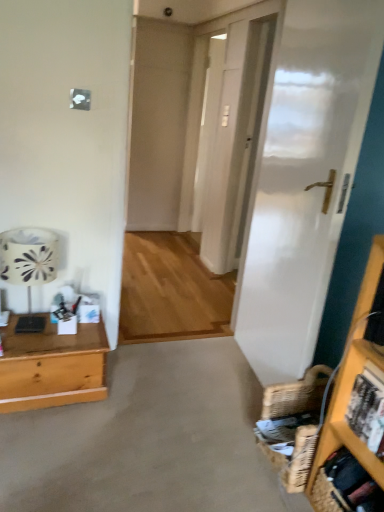
In order to click on vacant space in front of white fabric lampshade at left in this screenshot , I will do `click(34, 345)`.